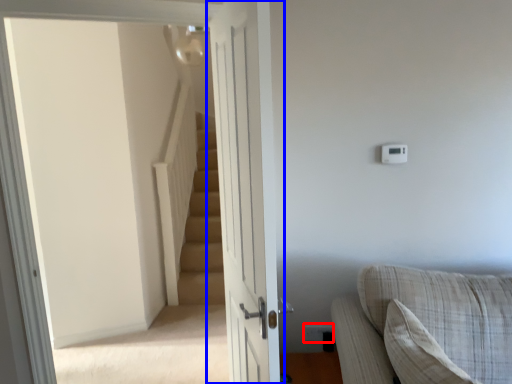
Question: Which object appears farthest to the camera in this image, electric outlet (highlighted by a red box) or door (highlighted by a blue box)?

Choices:
 (A) electric outlet
 (B) door

Answer: (A)